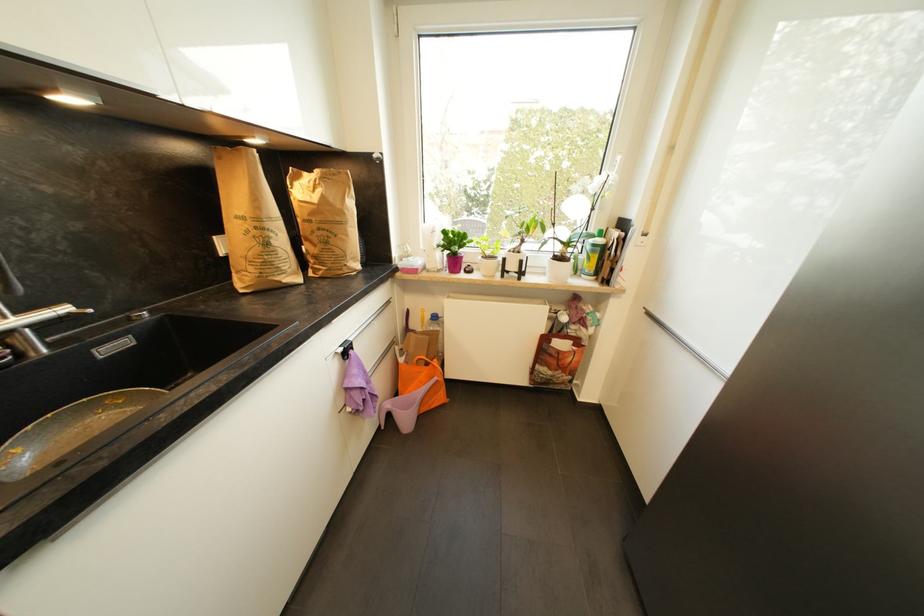
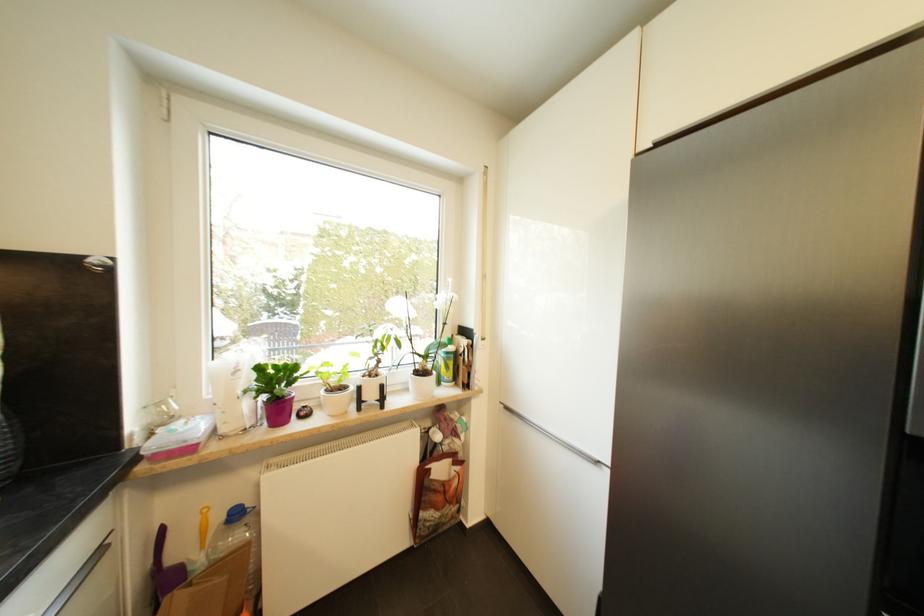
Locate, in the second image, the point that corresponds to point 599,246 in the first image.

(453, 355)